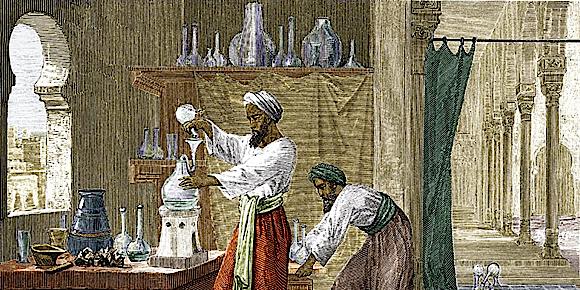
Where is `glassware`? This screenshot has height=290, width=580. glassware is located at coordinates pos(237,49), pos(304,55).